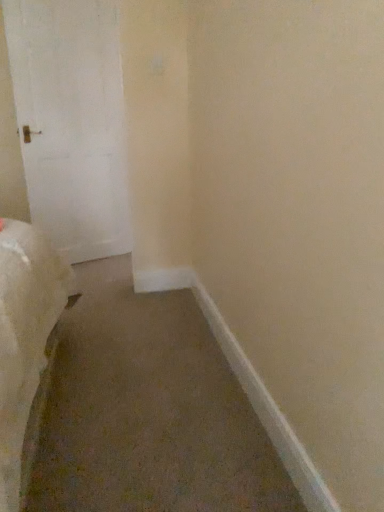
Question: In terms of width, does white matte door at left look wider or thinner when compared to white smooth baseboard at lower right?

Choices:
 (A) thin
 (B) wide

Answer: (B)

Question: Relative to white smooth baseboard at lower right, is white matte door at left in front or behind?

Choices:
 (A) behind
 (B) front

Answer: (A)

Question: From the image's perspective, is white matte door at left above or below white smooth baseboard at lower right?

Choices:
 (A) below
 (B) above

Answer: (B)

Question: In the image, is white smooth baseboard at lower right on the left side or the right side of white matte door at left?

Choices:
 (A) right
 (B) left

Answer: (A)

Question: From their relative heights in the image, would you say white smooth baseboard at lower right is taller or shorter than white matte door at left?

Choices:
 (A) tall
 (B) short

Answer: (B)

Question: Relative to white matte door at left, is white smooth baseboard at lower right in front or behind?

Choices:
 (A) behind
 (B) front

Answer: (B)

Question: From the image's perspective, relative to white matte door at left, is white smooth baseboard at lower right above or below?

Choices:
 (A) below
 (B) above

Answer: (A)